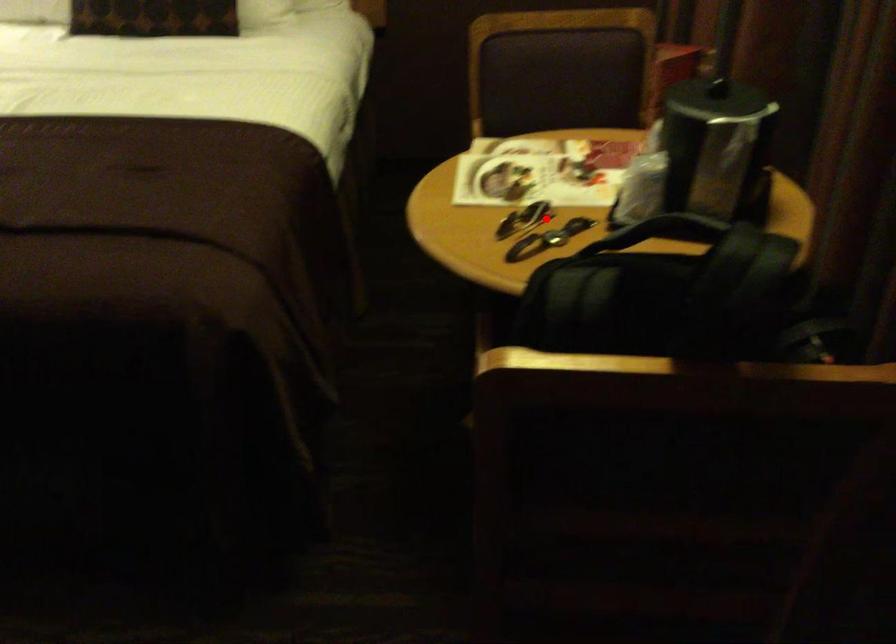
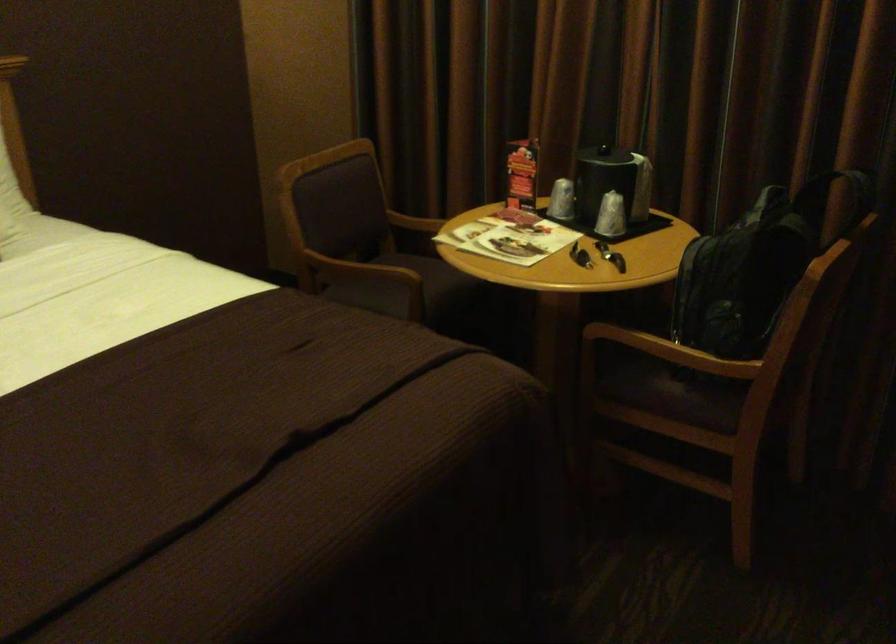
Where in the second image is the point corresponding to the highlighted location from the first image?

(580, 254)